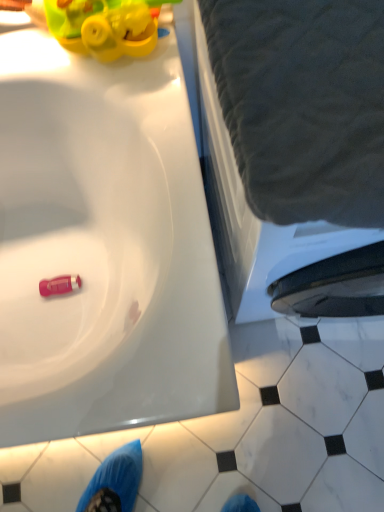
Question: From the image's perspective, is white marble tile at lower right under pink rubber toy at lower left?

Choices:
 (A) yes
 (B) no

Answer: (A)

Question: Does white marble tile at lower right have a lesser height compared to pink rubber toy at lower left?

Choices:
 (A) yes
 (B) no

Answer: (A)

Question: Is white marble tile at lower right facing away from pink rubber toy at lower left?

Choices:
 (A) yes
 (B) no

Answer: (B)

Question: From the image's perspective, does white marble tile at lower right appear higher than pink rubber toy at lower left?

Choices:
 (A) yes
 (B) no

Answer: (B)

Question: From a real-world perspective, is white marble tile at lower right over pink rubber toy at lower left?

Choices:
 (A) no
 (B) yes

Answer: (A)

Question: Does point (218, 200) appear closer or farther from the camera than point (324, 471)?

Choices:
 (A) farther
 (B) closer

Answer: (B)

Question: From their relative heights in the image, would you say gray fabric at upper right is taller or shorter than white marble tile at lower right?

Choices:
 (A) short
 (B) tall

Answer: (B)

Question: Is gray fabric at upper right wider or thinner than white marble tile at lower right?

Choices:
 (A) thin
 (B) wide

Answer: (B)

Question: Would you say gray fabric at upper right is to the left or to the right of white marble tile at lower right in the picture?

Choices:
 (A) right
 (B) left

Answer: (B)

Question: Based on their positions, is pink rubber toy at lower left located to the left or right of gray fabric at upper right?

Choices:
 (A) left
 (B) right

Answer: (A)

Question: Is pink rubber toy at lower left wider or thinner than gray fabric at upper right?

Choices:
 (A) thin
 (B) wide

Answer: (A)

Question: Choose the correct answer: Is pink rubber toy at lower left inside gray fabric at upper right or outside it?

Choices:
 (A) inside
 (B) outside

Answer: (B)

Question: From a real-world perspective, is pink rubber toy at lower left positioned above or below gray fabric at upper right?

Choices:
 (A) below
 (B) above

Answer: (A)

Question: Looking at their shapes, would you say white marble tile at lower right is wider or thinner than pink rubber toy at lower left?

Choices:
 (A) thin
 (B) wide

Answer: (B)

Question: In terms of height, does white marble tile at lower right look taller or shorter compared to pink rubber toy at lower left?

Choices:
 (A) tall
 (B) short

Answer: (B)